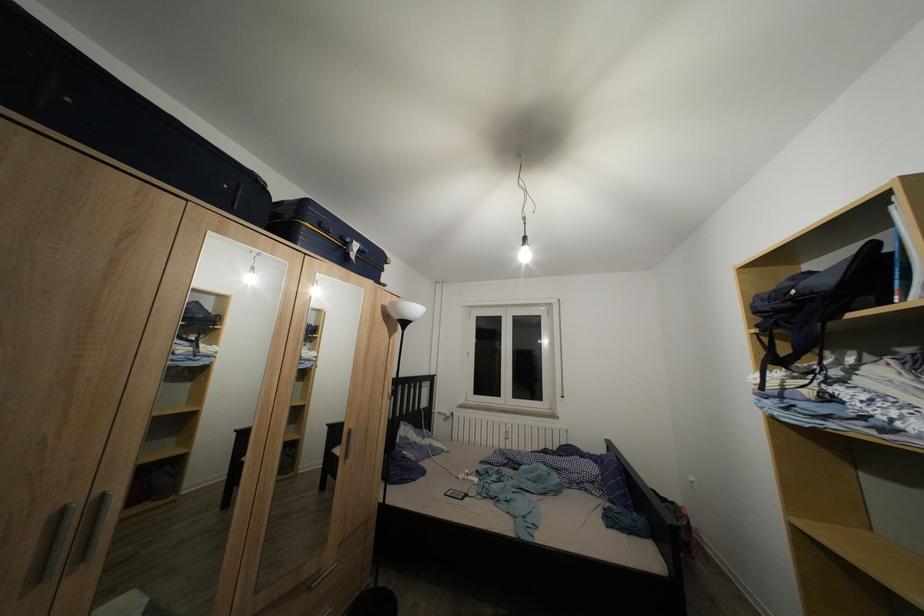
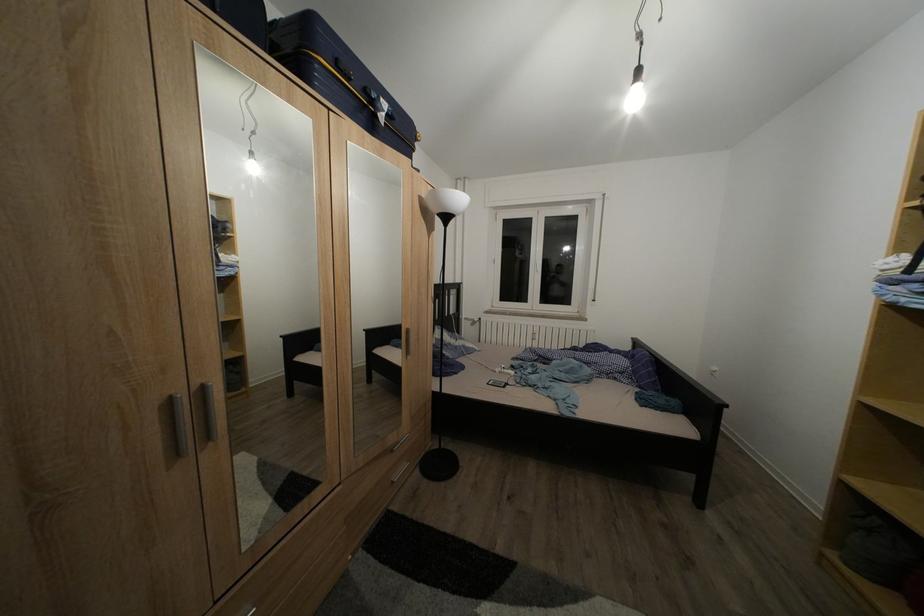
What movement of the cameraman would produce the second image?

The cameraman moved toward left, forward.